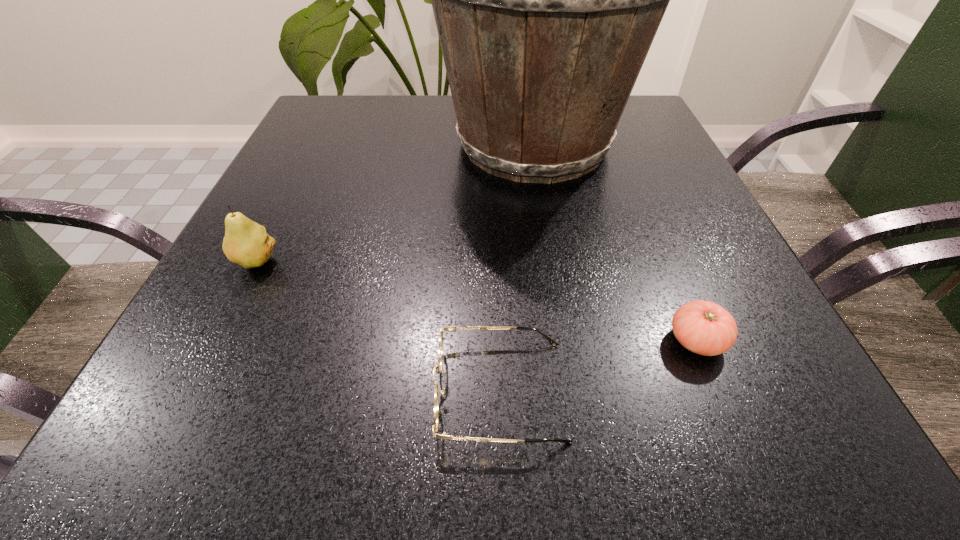
In the image, there is a desktop. Identify the location of vacant space at the left edge. (269, 271).

The width and height of the screenshot is (960, 540). I want to click on vacant space at the right edge, so click(712, 221).

Locate an element on the screen. The width and height of the screenshot is (960, 540). blank area at the far left corner is located at coordinates (339, 112).

What are the coordinates of `free point at the near left corner` in the screenshot? It's located at (228, 396).

In the image, there is a desktop. Identify the location of vacant space at the near right corner. The image size is (960, 540). (776, 410).

You are a GUI agent. You are given a task and a screenshot of the screen. Output one action in this format:
    pyautogui.click(x=<x>, y=<y>)
    Task: Click on the free space between the bucket and the spectacles
    
    Given the screenshot: What is the action you would take?
    pyautogui.click(x=516, y=267)

Find the location of a particular element. The width and height of the screenshot is (960, 540). unoccupied position between the tomato and the farthest object is located at coordinates (615, 242).

You are a GUI agent. You are given a task and a screenshot of the screen. Output one action in this format:
    pyautogui.click(x=<x>, y=<y>)
    Task: Click on the empty location between the tallest object and the third nearest object
    The image size is (960, 540).
    Given the screenshot: What is the action you would take?
    pyautogui.click(x=395, y=203)

This screenshot has width=960, height=540. What are the coordinates of `free spot between the pear and the tallest object` in the screenshot? It's located at (395, 203).

Find the location of a particular element. The image size is (960, 540). vacant space that's between the leftmost object and the bucket is located at coordinates (395, 203).